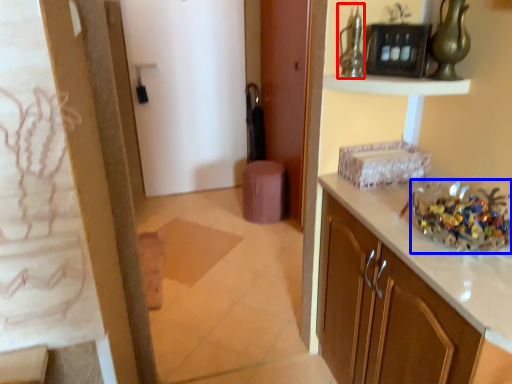
Question: Which of the following is the closest to the observer, glass vase (highlighted by a red box) or floral arrangement (highlighted by a blue box)?

Choices:
 (A) glass vase
 (B) floral arrangement

Answer: (B)